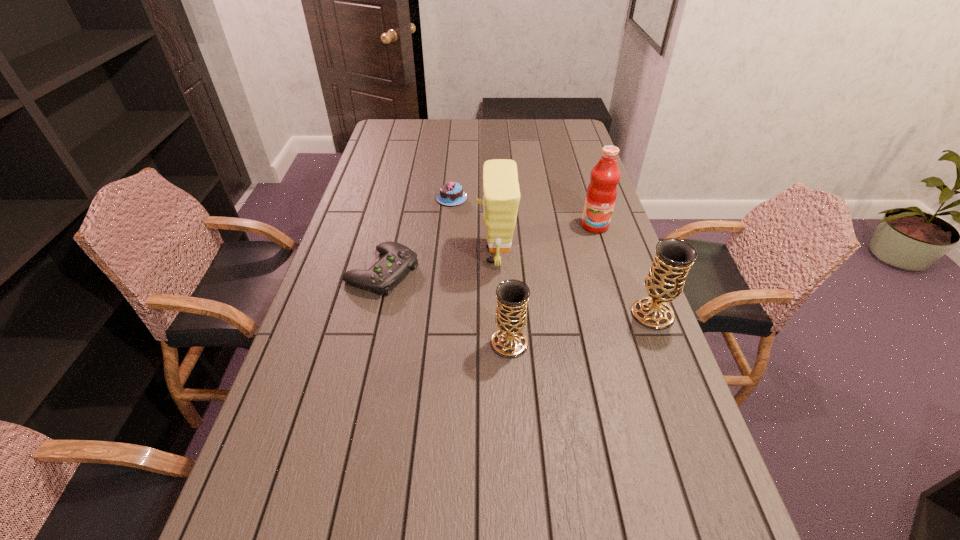
The width and height of the screenshot is (960, 540). Identify the location of the left chalice. (509, 341).

Where is `the shorter chalice`? The height and width of the screenshot is (540, 960). the shorter chalice is located at coordinates (509, 341).

You are a GUI agent. You are given a task and a screenshot of the screen. Output one action in this format:
    pyautogui.click(x=<x>, y=<y>)
    Task: Click on the third tallest object
    
    Given the screenshot: What is the action you would take?
    pyautogui.click(x=673, y=258)

The width and height of the screenshot is (960, 540). What are the coordinates of `the taller chalice` in the screenshot? It's located at (x=673, y=258).

In order to click on the farthest object in this screenshot , I will do `click(451, 193)`.

This screenshot has height=540, width=960. What are the coordinates of `the fifth object from right to left` in the screenshot? It's located at (451, 193).

In order to click on fruit juice in this screenshot , I will do `click(601, 194)`.

At what (x,y) coordinates should I click in order to perform the action: click on sponge. Please return your answer as a coordinate pair (x, y). This screenshot has width=960, height=540. Looking at the image, I should click on (501, 198).

What are the coordinates of `the leftmost object` in the screenshot? It's located at (398, 259).

Find the location of a particular element. free space located on the left of the fourth tallest object is located at coordinates (404, 343).